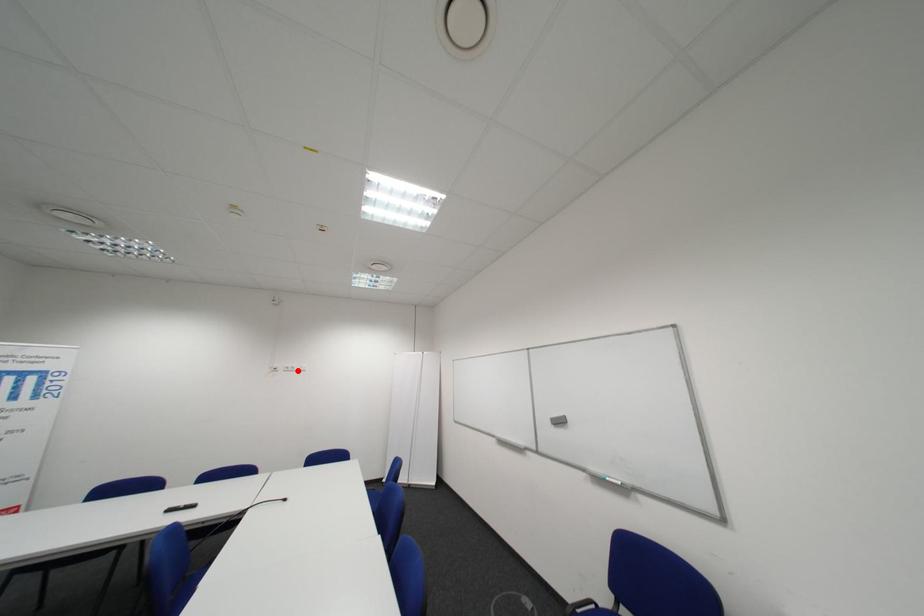
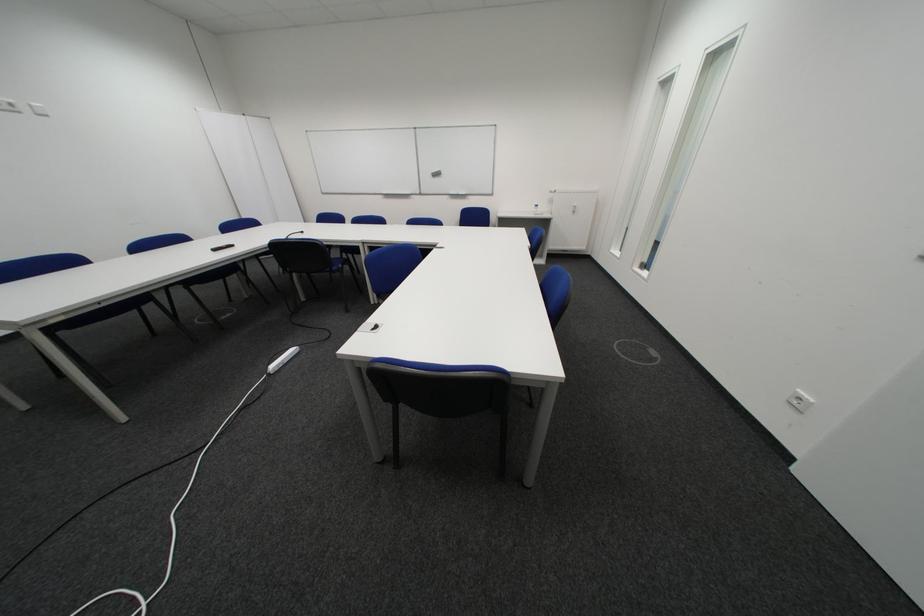
Question: I am providing you with two images of the same scene from different viewpoints. In image1, a red point is highlighted. Considering the same 3D point in image2, which of the following is correct?

Choices:
 (A) It is closer
 (B) It is farther

Answer: (B)